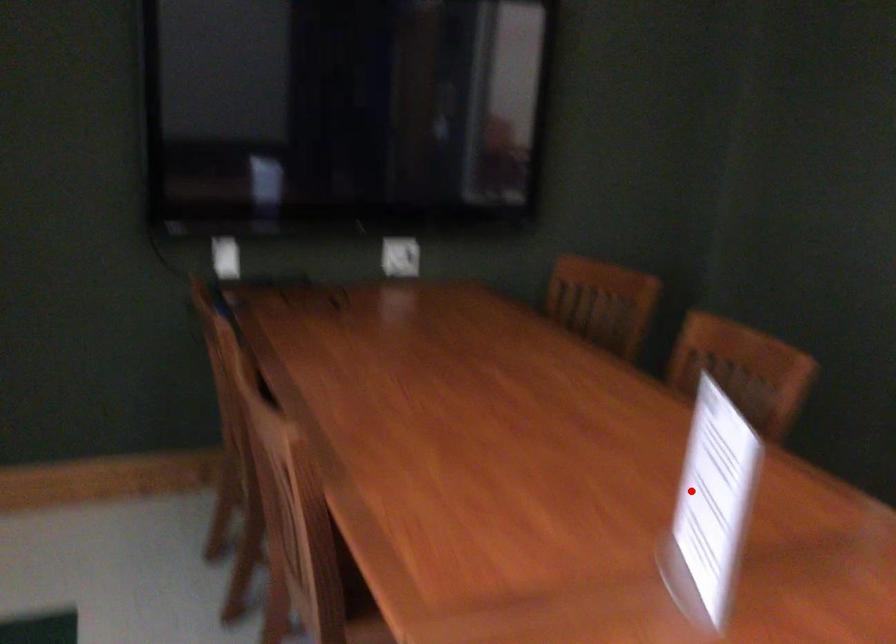
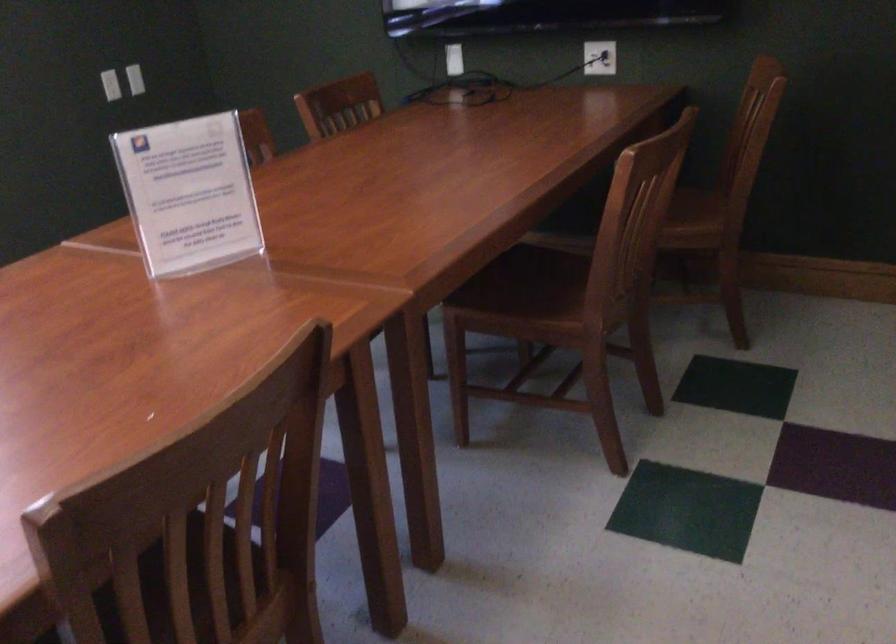
Where in the second image is the point corresponding to the highlighted location from the first image?

(188, 194)